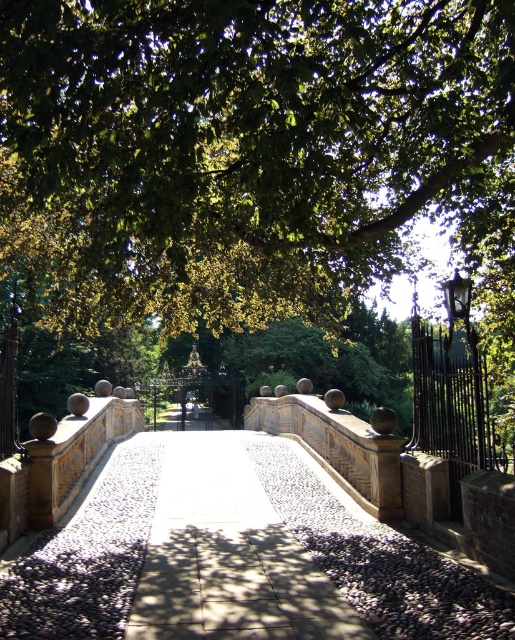
Does white stone path at center have a greater width compared to black wrought iron fence at right?

Yes.

Does white stone path at center have a lesser width compared to black wrought iron fence at right?

Incorrect, white stone path at center's width is not less than black wrought iron fence at right's.

Does point (188, 582) come behind point (513, 444)?

That is False.

Where is `white stone path at center`? white stone path at center is located at coordinates (229, 556).

Is point (116, 291) behind point (472, 337)?

That is True.

Which is in front, point (252, 96) or point (465, 413)?

Point (252, 96)

Which is behind, point (283, 124) or point (472, 460)?

Point (472, 460)

In order to click on green leafy tree at upper center in this screenshot , I will do `click(244, 141)`.

Does green leafy tree at upper center have a larger size compared to white stone path at center?

Correct, green leafy tree at upper center is larger in size than white stone path at center.

Is green leafy tree at upper center smaller than white stone path at center?

Incorrect, green leafy tree at upper center is not smaller in size than white stone path at center.

Locate an element on the screen. This screenshot has width=515, height=640. green leafy tree at upper center is located at coordinates (244, 141).